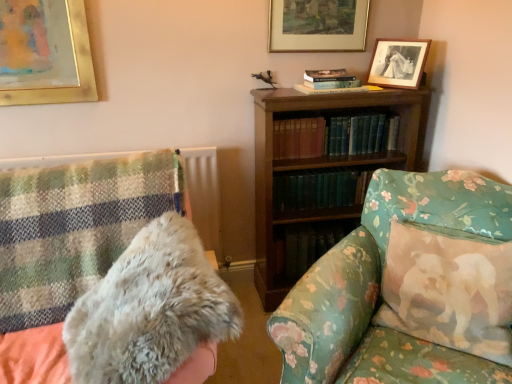
Image resolution: width=512 pixels, height=384 pixels. Identify the location of floral fabric couch at center. (380, 288).

You are a GUI agent. You are given a task and a screenshot of the screen. Output one action in this format:
    pyautogui.click(x=<x>, y=<y>)
    Task: Click on the green leather book at center, positioned as the first book in top-to-bottom order
    The height and width of the screenshot is (384, 512).
    Given the screenshot: What is the action you would take?
    pyautogui.click(x=334, y=136)

What do you see at coordinates (448, 276) in the screenshot? The image size is (512, 384). I see `fluffy cotton pillow at right` at bounding box center [448, 276].

At what (x,y) coordinates should I click in order to perform the action: click on green hardcover books at center, placed as the first book when sorted from bottom to top. Please return your answer as a coordinate pair (x, y). Looking at the image, I should click on (320, 189).

What do you see at coordinates (320, 189) in the screenshot?
I see `green hardcover books at center, positioned as the 2th book in top-to-bottom order` at bounding box center [320, 189].

Identify the location of gold-framed picture at upper center, the second picture frame in the right-to-left sequence. (318, 25).

This screenshot has height=384, width=512. What do you see at coordinates (106, 275) in the screenshot?
I see `fluffy fabric blanket at left` at bounding box center [106, 275].

What is the approximate width of fluffy fabric blanket at left?

fluffy fabric blanket at left is 36.09 inches in width.

The width and height of the screenshot is (512, 384). I want to click on wooden bookcase at center, so click(320, 164).

Between floral fabric couch at center and green leather book at center, positioned as the first book in top-to-bottom order, which one has smaller size?

green leather book at center, positioned as the first book in top-to-bottom order, is smaller.

Is there a large distance between floral fabric couch at center and green leather book at center, positioned as the first book in top-to-bottom order?

They are positioned close to each other.

From a real-world perspective, between floral fabric couch at center and green leather book at center, which ranks as the 2th book in bottom-to-top order, who is vertically lower?

floral fabric couch at center is physically lower.

Is floral fabric couch at center oriented away from green leather book at center, which ranks as the 2th book in bottom-to-top order?

No, floral fabric couch at center's orientation is not away from green leather book at center, which ranks as the 2th book in bottom-to-top order.

Who is shorter, floral fabric couch at center or fluffy fabric blanket at left?

Standing shorter between the two is floral fabric couch at center.

The height and width of the screenshot is (384, 512). Identify the location of studio couch lying below the fluffy fabric blanket at left (from the image's perspective). (380, 288).

Is floral fabric couch at center placed right next to fluffy fabric blanket at left?

No, floral fabric couch at center is not with fluffy fabric blanket at left.

What are the coordinates of `pillow below the green hardcover books at center, positioned as the 2th book in top-to-bottom order (from a real-world perspective)` in the screenshot? It's located at (448, 276).

Is green hardcover books at center, positioned as the 2th book in top-to-bottom order, facing towards fluffy cotton pillow at right?

Yes, green hardcover books at center, positioned as the 2th book in top-to-bottom order, is facing fluffy cotton pillow at right.

Is green hardcover books at center, positioned as the 2th book in top-to-bottom order, wider or thinner than fluffy cotton pillow at right?

Clearly, green hardcover books at center, positioned as the 2th book in top-to-bottom order, has less width compared to fluffy cotton pillow at right.

Is green hardcover books at center, positioned as the 2th book in top-to-bottom order, spatially inside fluffy cotton pillow at right, or outside of it?

green hardcover books at center, positioned as the 2th book in top-to-bottom order, is not inside fluffy cotton pillow at right, it's outside.

Is green leather book at center, which ranks as the 2th book in bottom-to-top order, positioned before fluffy fabric blanket at left?

No, green leather book at center, which ranks as the 2th book in bottom-to-top order, is further to the viewer.

Is green leather book at center, positioned as the first book in top-to-bottom order, aimed at fluffy fabric blanket at left?

No, green leather book at center, positioned as the first book in top-to-bottom order, is not turned towards fluffy fabric blanket at left.

Is green leather book at center, which ranks as the 2th book in bottom-to-top order, to the left of fluffy fabric blanket at left from the viewer's perspective?

In fact, green leather book at center, which ranks as the 2th book in bottom-to-top order, is to the right of fluffy fabric blanket at left.

Which is more to the left, wooden bookcase at center or green leather book at center, positioned as the first book in top-to-bottom order?

From the viewer's perspective, green leather book at center, positioned as the first book in top-to-bottom order, appears more on the left side.

From the image's perspective, which one is positioned higher, wooden bookcase at center or green leather book at center, positioned as the first book in top-to-bottom order?

green leather book at center, positioned as the first book in top-to-bottom order, appears higher in the image.

Is wooden bookcase at center behind green leather book at center, which ranks as the 2th book in bottom-to-top order?

No, it is in front of green leather book at center, which ranks as the 2th book in bottom-to-top order.

Which of these two, fluffy fabric blanket at left or wooden bookcase at center, is bigger?

fluffy fabric blanket at left is bigger.

Is fluffy fabric blanket at left further to camera compared to wooden bookcase at center?

No.

Are fluffy fabric blanket at left and wooden bookcase at center making contact?

fluffy fabric blanket at left and wooden bookcase at center are clearly separated.

In terms of size, does wooden bookcase at center appear bigger or smaller than fluffy fabric blanket at left?

Clearly, wooden bookcase at center is smaller in size than fluffy fabric blanket at left.

Is wooden bookcase at center turned away from fluffy fabric blanket at left?

No, wooden bookcase at center is not facing the opposite direction of fluffy fabric blanket at left.

Consider the image. Which object is further away from the camera, wooden bookcase at center or fluffy fabric blanket at left?

wooden bookcase at center is more distant.

Can you tell me how much wooden bookcase at center and fluffy fabric blanket at left differ in facing direction?

The angular difference between wooden bookcase at center and fluffy fabric blanket at left is 0.392 degrees.

From a real-world perspective, starting from the floral fabric couch at center, which book is the 2nd one vertically above it? Please provide its 2D coordinates.

[(334, 136)]

You are a GUI agent. You are given a task and a screenshot of the screen. Output one action in this format:
    pyautogui.click(x=<x>, y=<y>)
    Task: Click on the furniture that is behind the floral fabric couch at center
    
    Given the screenshot: What is the action you would take?
    pyautogui.click(x=106, y=275)

From the image, which object appears to be nearer to gold-framed picture at upper center, the second picture frame in the right-to-left sequence, floral fabric couch at center or fluffy fabric blanket at left?

The object closer to gold-framed picture at upper center, the second picture frame in the right-to-left sequence, is floral fabric couch at center.

Which object lies further to the anchor point green hardcover books at center, placed as the first book when sorted from bottom to top, fluffy cotton pillow at right or green leather book at center, positioned as the first book in top-to-bottom order?

fluffy cotton pillow at right.

Considering their positions, is wooden bookcase at center positioned further to green hardcover books at center, placed as the first book when sorted from bottom to top, than floral fabric couch at center?

floral fabric couch at center is positioned further to the anchor green hardcover books at center, placed as the first book when sorted from bottom to top.

Which object lies further to the anchor point green hardcover books at center, placed as the first book when sorted from bottom to top, green leather book at center, which ranks as the 2th book in bottom-to-top order, or fluffy fabric blanket at left?

fluffy fabric blanket at left is further to green hardcover books at center, placed as the first book when sorted from bottom to top.

From the image, which object appears to be nearer to wooden bookcase at center, floral fabric couch at center or green hardcover books at center, placed as the first book when sorted from bottom to top?

green hardcover books at center, placed as the first book when sorted from bottom to top, is positioned closer to the anchor wooden bookcase at center.

When comparing their distances from wooden bookcase at center, does fluffy cotton pillow at right or fluffy fabric blanket at left seem further?

fluffy fabric blanket at left is further to wooden bookcase at center.

Considering their positions, is fluffy cotton pillow at right positioned closer to floral fabric couch at center than gold-framed picture at upper center, marked as the 1th picture frame in a left-to-right arrangement?

fluffy cotton pillow at right.

Which object lies further to the anchor point gold-framed picture at upper center, the second picture frame in the right-to-left sequence, green leather book at center, positioned as the first book in top-to-bottom order, or fluffy cotton pillow at right?

fluffy cotton pillow at right.

Image resolution: width=512 pixels, height=384 pixels. In order to click on picture frame that lies between gold-framed picture at upper center, the second picture frame in the right-to-left sequence, and green leather book at center, positioned as the first book in top-to-bottom order, from top to bottom in this screenshot , I will do `click(398, 62)`.

The image size is (512, 384). Identify the location of book located between fluffy cotton pillow at right and green hardcover books at center, positioned as the 2th book in top-to-bottom order, in the depth direction. 334,136.

Where is `picture frame between gold-framed picture at upper center, marked as the 1th picture frame in a left-to-right arrangement, and fluffy fabric blanket at left vertically`? This screenshot has height=384, width=512. picture frame between gold-framed picture at upper center, marked as the 1th picture frame in a left-to-right arrangement, and fluffy fabric blanket at left vertically is located at coordinates (398, 62).

The height and width of the screenshot is (384, 512). Find the location of `book positioned between fluffy fabric blanket at left and green hardcover books at center, positioned as the 2th book in top-to-bottom order, from near to far`. book positioned between fluffy fabric blanket at left and green hardcover books at center, positioned as the 2th book in top-to-bottom order, from near to far is located at coordinates (334, 136).